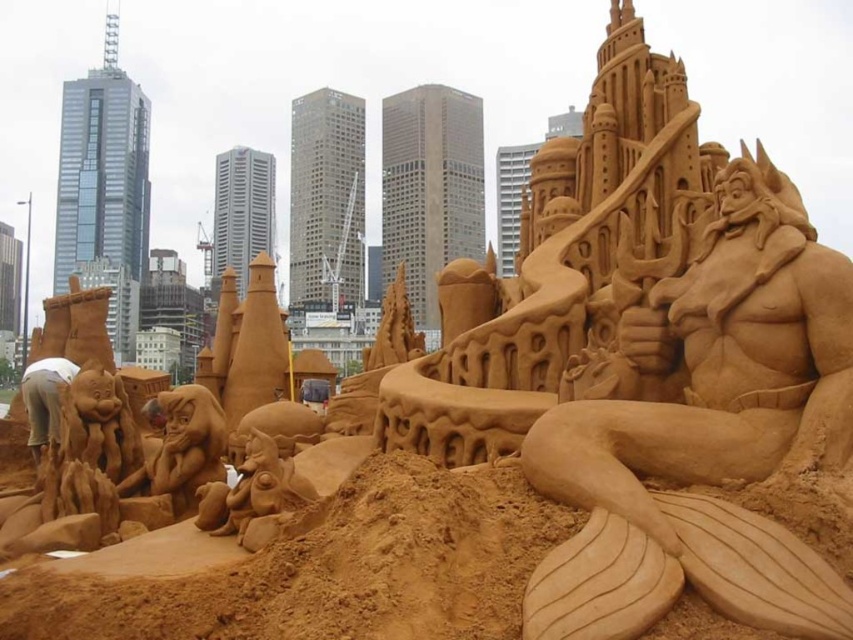
Which is behind, point (730, 272) or point (506, 502)?

The point (730, 272) is behind.

Can you confirm if brown sand merman at center is bigger than brown sand sculpture at lower center?

Yes, brown sand merman at center is bigger than brown sand sculpture at lower center.

Is point (807, 228) farther from camera compared to point (180, 602)?

Yes.

You are a GUI agent. You are given a task and a screenshot of the screen. Output one action in this format:
    pyautogui.click(x=<x>, y=<y>)
    Task: Click on the brown sand merman at center
    This screenshot has width=853, height=640.
    Given the screenshot: What is the action you would take?
    tap(700, 433)

Who is positioned more to the left, brown sand sculpture at lower center or brown sand sculpture at lower left?

brown sand sculpture at lower left

Between brown sand sculpture at lower center and brown sand sculpture at lower left, which one is positioned higher?

brown sand sculpture at lower left is higher up.

This screenshot has height=640, width=853. What do you see at coordinates (334, 570) in the screenshot? I see `brown sand sculpture at lower center` at bounding box center [334, 570].

This screenshot has width=853, height=640. Find the location of `brown sand sculpture at lower center`. brown sand sculpture at lower center is located at coordinates (334, 570).

Does brown sand merman at center have a lesser width compared to brown sand sculpture at lower left?

Incorrect, brown sand merman at center's width is not less than brown sand sculpture at lower left's.

Can you confirm if brown sand merman at center is shorter than brown sand sculpture at lower left?

No.

Is point (693, 465) less distant than point (55, 394)?

Yes, it is in front of point (55, 394).

This screenshot has width=853, height=640. In order to click on brown sand merman at center in this screenshot , I will do `click(700, 433)`.